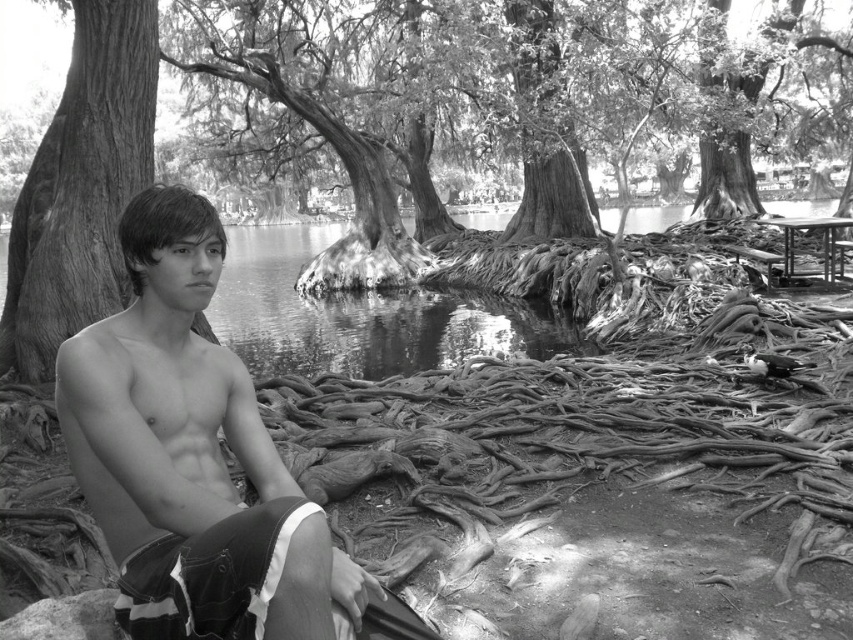
Question: Which object appears closest to the camera in this image?

Choices:
 (A) smooth denim shorts at center
 (B) smooth bark tree trunk at left
 (C) rough bark tree at left

Answer: (A)

Question: Does rough bark tree at left have a smaller size compared to wooden picnic table at right?

Choices:
 (A) no
 (B) yes

Answer: (A)

Question: Does smooth bark tree trunk at left appear over wooden picnic table at right?

Choices:
 (A) yes
 (B) no

Answer: (B)

Question: Which point appears farthest from the camera in this image?

Choices:
 (A) [12, 244]
 (B) [827, 221]

Answer: (B)

Question: Which of the following is the closest to the observer?

Choices:
 (A) smooth denim shorts at center
 (B) rough bark tree at left
 (C) wooden picnic table at right

Answer: (A)

Question: Considering the relative positions of smooth denim shorts at center and smooth bark tree trunk at left in the image provided, where is smooth denim shorts at center located with respect to smooth bark tree trunk at left?

Choices:
 (A) below
 (B) above

Answer: (A)